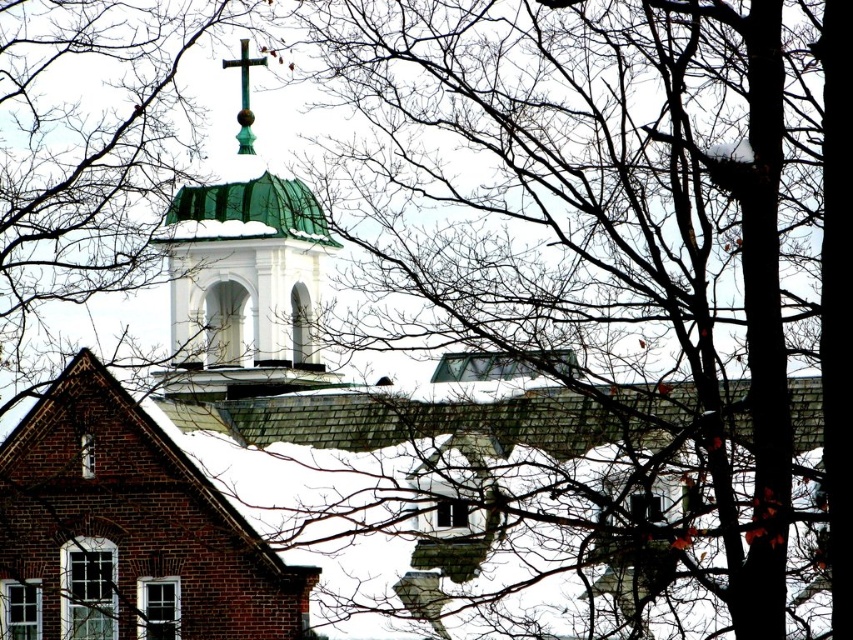
Does brick church at center have a lesser width compared to green patinated metal cross at upper center?

In fact, brick church at center might be wider than green patinated metal cross at upper center.

Who is higher up, brick church at center or green patinated metal cross at upper center?

green patinated metal cross at upper center is above.

Is point (126, 420) more distant than point (247, 74)?

No, (126, 420) is in front of (247, 74).

Where is `brick church at center`? The width and height of the screenshot is (853, 640). brick church at center is located at coordinates (126, 531).